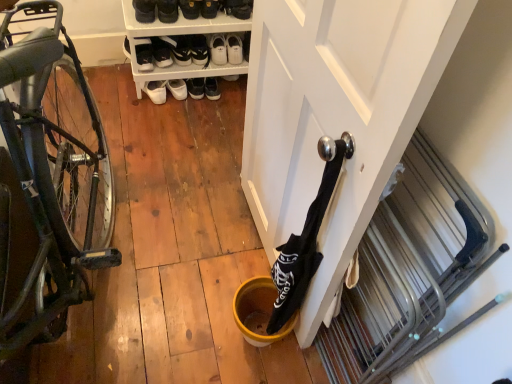
Where is `vacant area situated below white matte door at center (from a real-world perspective)`? Image resolution: width=512 pixels, height=384 pixels. vacant area situated below white matte door at center (from a real-world perspective) is located at coordinates (247, 236).